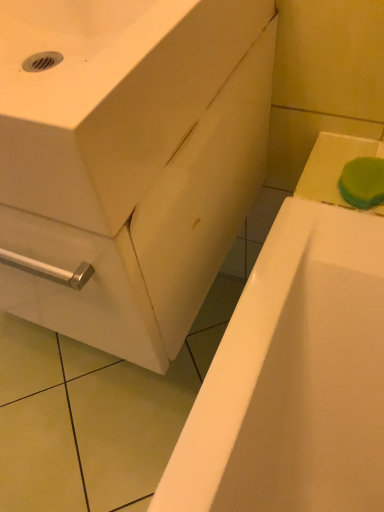
Question: In terms of height, does green sponge at upper right look taller or shorter compared to white glossy sink at center?

Choices:
 (A) tall
 (B) short

Answer: (B)

Question: From a real-world perspective, is green sponge at upper right positioned above or below white glossy sink at center?

Choices:
 (A) above
 (B) below

Answer: (B)

Question: Considering the real-world distances, which object is farthest from the white glossy bathtub at lower right?

Choices:
 (A) white glossy sink at center
 (B) green sponge at upper right

Answer: (A)

Question: Which of these objects is positioned closest to the white glossy sink at center?

Choices:
 (A) white glossy bathtub at lower right
 (B) green sponge at upper right

Answer: (A)